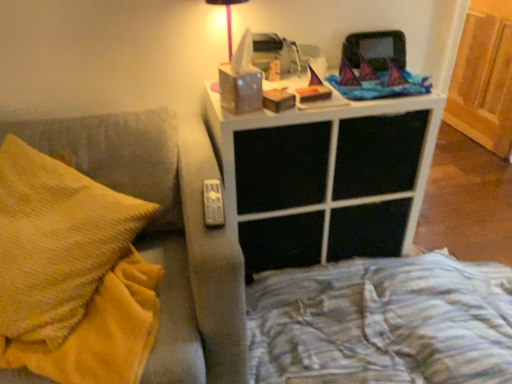
Identify the location of free point above white matte nightstand at upper center (from a real-world perspective). (342, 91).